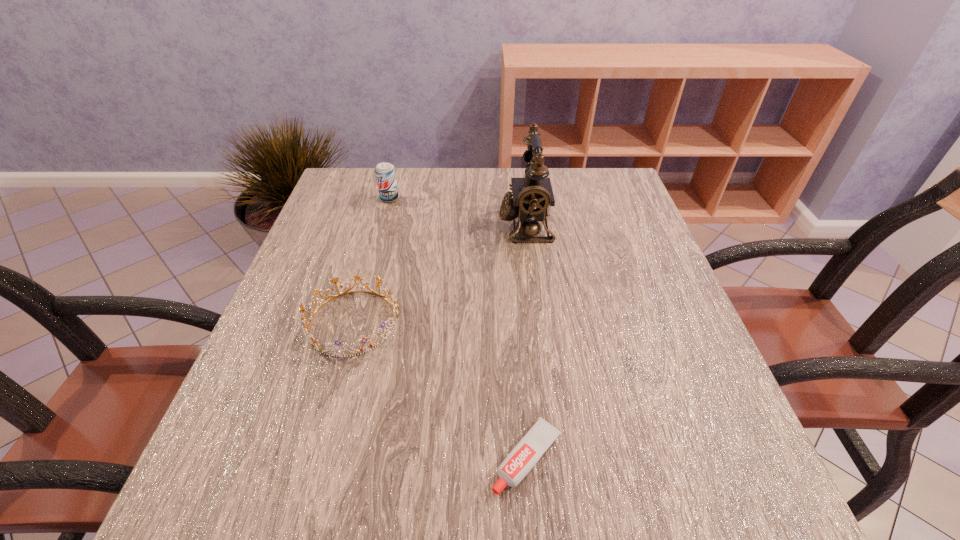
Find the location of a particular element. vacant region located 0.320m on the front-facing side of the third tallest object is located at coordinates (565, 322).

At what (x,y) coordinates should I click in order to perform the action: click on vacant space located 0.360m on the back of the toothpaste. Please return your answer as a coordinate pair (x, y). Looking at the image, I should click on (513, 270).

The height and width of the screenshot is (540, 960). What are the coordinates of `telephone that is at the far edge` in the screenshot? It's located at (530, 201).

Find the location of a particular element. The width and height of the screenshot is (960, 540). beer can present at the far edge is located at coordinates (385, 174).

This screenshot has width=960, height=540. In order to click on object that is positioned at the near edge in this screenshot , I will do `click(524, 456)`.

Find the location of a particular element. beer can that is positioned at the left edge is located at coordinates (385, 174).

At what (x,y) coordinates should I click in order to perform the action: click on tiara situated at the left edge. Please return your answer as a coordinate pair (x, y). The height and width of the screenshot is (540, 960). Looking at the image, I should click on (394, 304).

The height and width of the screenshot is (540, 960). I want to click on object at the far left corner, so point(385,174).

You are a GUI agent. You are given a task and a screenshot of the screen. Output one action in this format:
    pyautogui.click(x=<x>, y=<y>)
    Task: Click on the free space at the far edge
    Image resolution: width=960 pixels, height=540 pixels.
    Given the screenshot: What is the action you would take?
    pyautogui.click(x=455, y=184)

You are a GUI agent. You are given a task and a screenshot of the screen. Output one action in this format:
    pyautogui.click(x=<x>, y=<y>)
    Task: Click on the vacant area at the near edge of the desktop
    Image resolution: width=960 pixels, height=540 pixels.
    Given the screenshot: What is the action you would take?
    pyautogui.click(x=354, y=465)